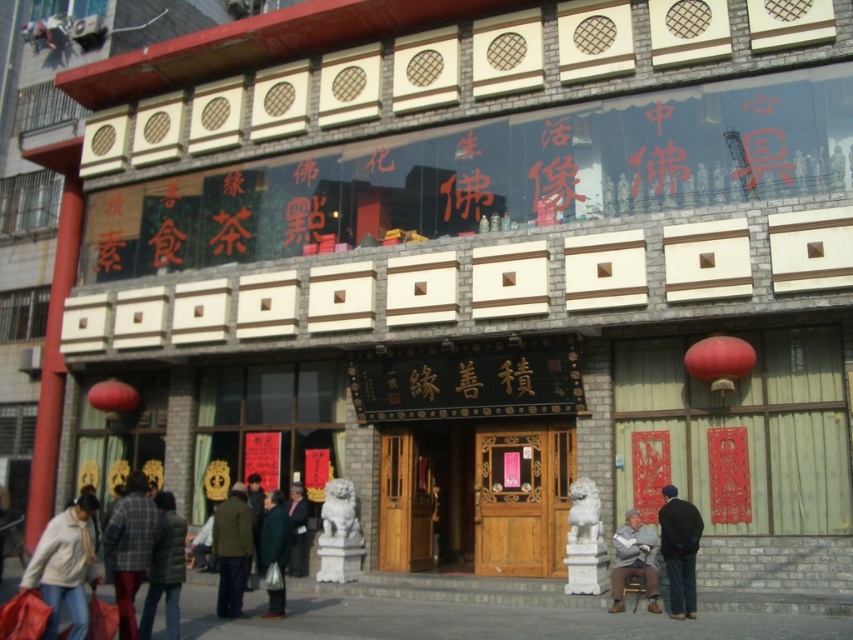
Does gray wool sweater at lower right have a greater height compared to dark gray coat at center?

In fact, gray wool sweater at lower right may be shorter than dark gray coat at center.

Between point (621, 600) and point (302, 500), which one is positioned in front?

Point (621, 600)

You are a GUI agent. You are given a task and a screenshot of the screen. Output one action in this format:
    pyautogui.click(x=<x>, y=<y>)
    Task: Click on the gray wool sweater at lower right
    This screenshot has width=853, height=640.
    Given the screenshot: What is the action you would take?
    pyautogui.click(x=634, y=561)

Can you confirm if white cotton jacket at lower left is shorter than green plaid coat at lower left?

No, white cotton jacket at lower left is not shorter than green plaid coat at lower left.

Which is more to the left, white cotton jacket at lower left or green plaid coat at lower left?

white cotton jacket at lower left is more to the left.

Which is in front, point (67, 536) or point (178, 538)?

Positioned in front is point (67, 536).

You are a GUI agent. You are given a task and a screenshot of the screen. Output one action in this format:
    pyautogui.click(x=<x>, y=<y>)
    Task: Click on the white cotton jacket at lower left
    The width and height of the screenshot is (853, 640).
    Given the screenshot: What is the action you would take?
    pyautogui.click(x=65, y=564)

Which is more to the right, white cotton jacket at lower left or dark gray fabric coat at lower center?

dark gray fabric coat at lower center is more to the right.

Is point (80, 588) positioned in front of point (265, 536)?

Yes, point (80, 588) is in front of point (265, 536).

Is point (79, 520) closer to camera compared to point (271, 497)?

Yes, point (79, 520) is in front of point (271, 497).

Identify the location of white cotton jacket at lower left. The width and height of the screenshot is (853, 640). (65, 564).